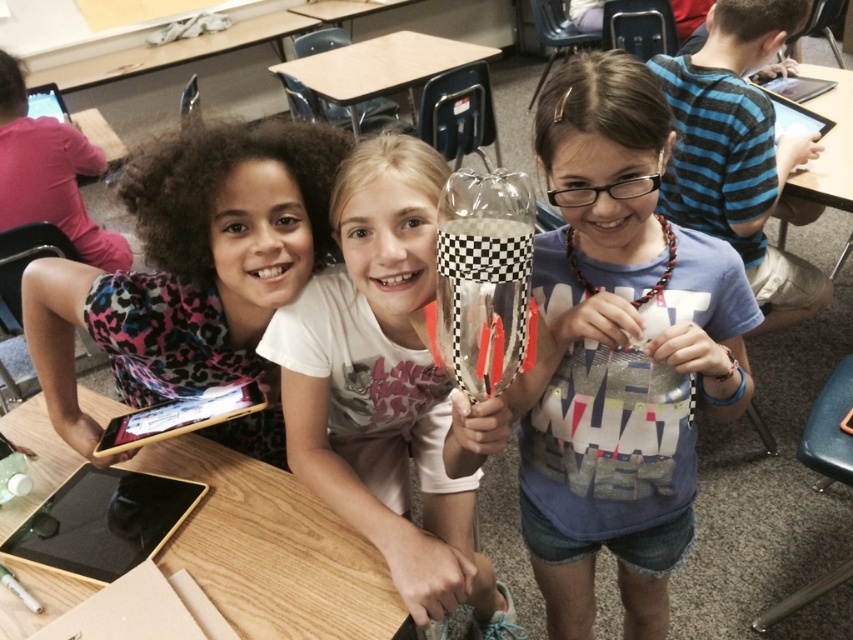
Is point (839, 173) closer to viewer compared to point (61, 122)?

Yes, point (839, 173) is closer to viewer.

Find the location of `wooden table at right`. wooden table at right is located at coordinates (828, 144).

What do you see at coordinates (828, 144) in the screenshot? I see `wooden table at right` at bounding box center [828, 144].

Where is `wooden table at right`? wooden table at right is located at coordinates (828, 144).

Can you confirm if wooden table at upper center is wider than black plastic tablet at upper right?

Indeed, wooden table at upper center has a greater width compared to black plastic tablet at upper right.

Where is `wooden table at upper center`? Image resolution: width=853 pixels, height=640 pixels. wooden table at upper center is located at coordinates (175, 51).

Find the location of a particular element. wooden table at upper center is located at coordinates (175, 51).

Which is more to the right, beige wood table at center or wooden table at right?

wooden table at right

Is point (442, 61) in front of point (827, 68)?

No, it is not.

Who is more distant from viewer, (300, 65) or (833, 100)?

Point (300, 65)

The image size is (853, 640). Find the location of `beige wood table at center`. beige wood table at center is located at coordinates (380, 67).